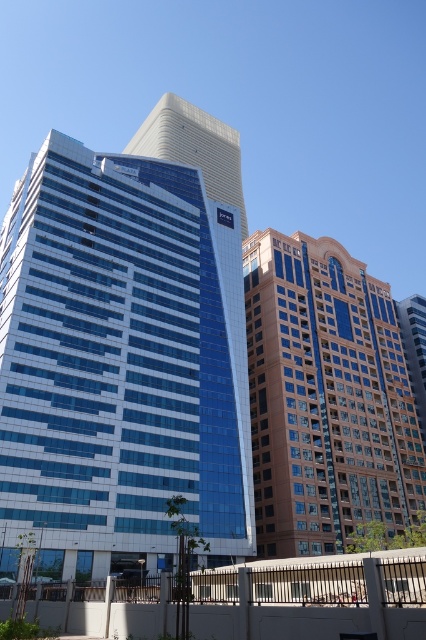
You are standing at the point labeled as point (325,397) in the image. Which building are you facing? Please answer with the building name mentioned in the scene description.

The point (325,397) indicates the brown brick building at center, so you are facing the brown brick building at center.

Based on the scene description, what are the coordinates of the blue glass building at center?

The coordinates of the blue glass building at center are point (120,364).

You are standing in front of the modern urban landscape and want to take a photo of both the blue glass building at center and the white glass skyscraper at center. Which building should you position to your left side in the camera frame to capture both in the shot?

To capture both the blue glass building at center and the white glass skyscraper at center in the photo, you should position the blue glass building at center to your left side in the camera frame since it is already located to the left of the white glass skyscraper at center in the scene.